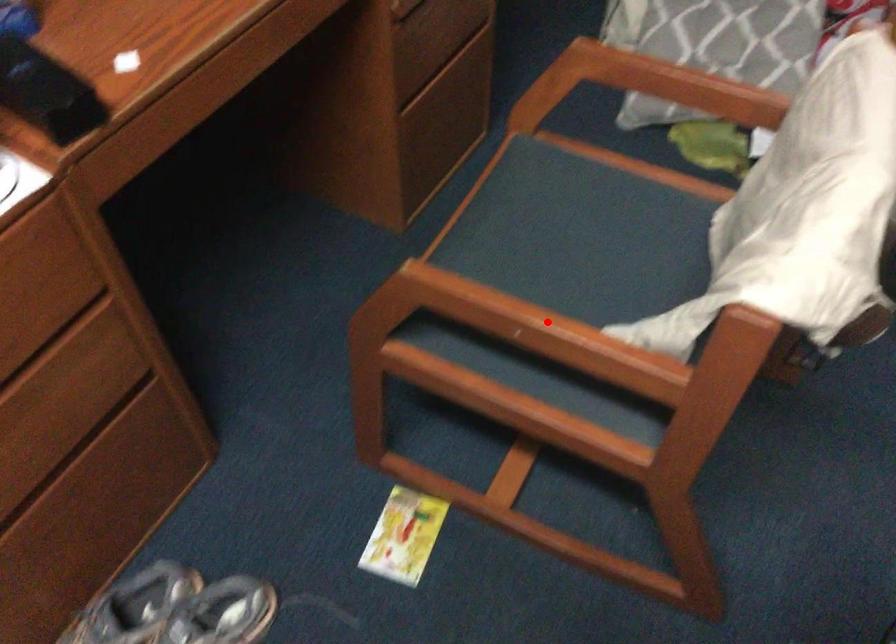
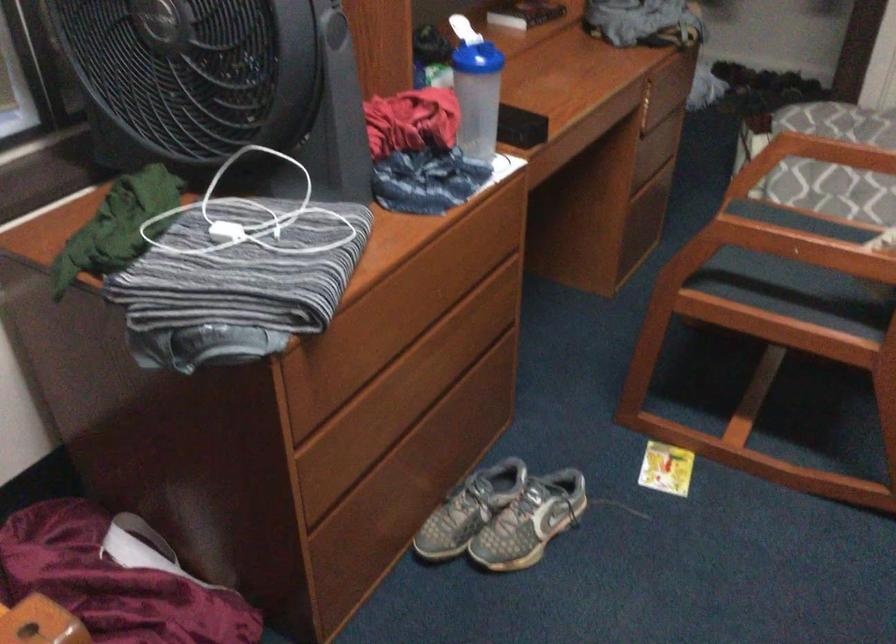
Find the pixel in the second image that matches the highlighted location in the first image.

(826, 234)